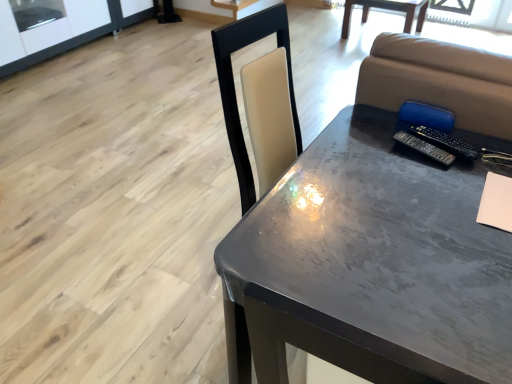
What are the coordinates of `free location in front of blue fabric armchair at upper right` in the screenshot? It's located at (444, 165).